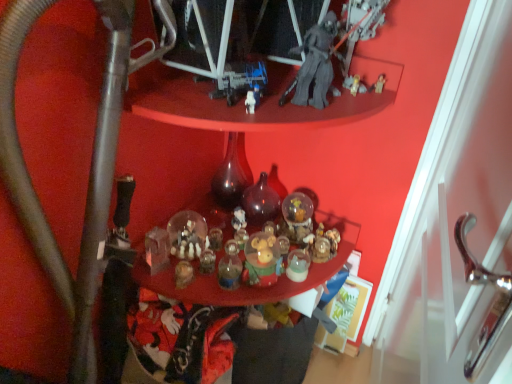
This screenshot has width=512, height=384. I want to click on translucent glass ornaments at center, so click(x=242, y=284).

Where is `translucent glass bottle at center, which is the first bottle in left-to-right order`? The height and width of the screenshot is (384, 512). translucent glass bottle at center, which is the first bottle in left-to-right order is located at coordinates coord(232,173).

Find the location of a particular element. This screenshot has width=512, height=384. metallic gray water pipe at lower left is located at coordinates click(92, 160).

Is translucent dark glass bottle at center, placed as the 1th bottle when sorted from right to left, spatially inside translucent glass ornaments at center, or outside of it?

translucent dark glass bottle at center, placed as the 1th bottle when sorted from right to left, is outside translucent glass ornaments at center.

Which of these two, translucent dark glass bottle at center, positioned as the second bottle in left-to-right order, or translucent glass ornaments at center, is bigger?

Bigger between the two is translucent glass ornaments at center.

How many degrees apart are the facing directions of translucent dark glass bottle at center, positioned as the second bottle in left-to-right order, and translucent glass ornaments at center?

98.2 degrees.

Could you tell me if translucent dark glass bottle at center, placed as the 1th bottle when sorted from right to left, is turned towards translucent glass ornaments at center?

No.

From the image's perspective, relative to translucent dark glass bottle at center, placed as the 1th bottle when sorted from right to left, is translucent glass bottle at center, which is the first bottle in left-to-right order, above or below?

translucent glass bottle at center, which is the first bottle in left-to-right order, is above translucent dark glass bottle at center, placed as the 1th bottle when sorted from right to left.

Can you confirm if translucent glass bottle at center, placed as the 2th bottle when sorted from right to left, is bigger than translucent dark glass bottle at center, positioned as the second bottle in left-to-right order?

Yes.

Is translucent glass bottle at center, which is the first bottle in left-to-right order, taller than translucent dark glass bottle at center, positioned as the second bottle in left-to-right order?

Indeed, translucent glass bottle at center, which is the first bottle in left-to-right order, has a greater height compared to translucent dark glass bottle at center, positioned as the second bottle in left-to-right order.

Where is `table below the translucent dark glass bottle at center, positioned as the second bottle in left-to-right order (from the image's perspective)`? This screenshot has width=512, height=384. table below the translucent dark glass bottle at center, positioned as the second bottle in left-to-right order (from the image's perspective) is located at coordinates (242, 284).

From the image's perspective, is translucent glass ornaments at center above or below translucent dark glass bottle at center, placed as the 1th bottle when sorted from right to left?

translucent glass ornaments at center is situated lower than translucent dark glass bottle at center, placed as the 1th bottle when sorted from right to left, in the image.

Does translucent glass ornaments at center have a greater height compared to translucent dark glass bottle at center, positioned as the second bottle in left-to-right order?

No.

Is translucent dark glass bottle at center, positioned as the second bottle in left-to-right order, not near metallic gray water pipe at lower left?

That's not correct — translucent dark glass bottle at center, positioned as the second bottle in left-to-right order, is a little close to metallic gray water pipe at lower left.

This screenshot has width=512, height=384. There is a metallic gray water pipe at lower left. In order to click on the 1st bottle above it (from a real-world perspective) in this screenshot , I will do `click(261, 202)`.

Which is behind, translucent dark glass bottle at center, positioned as the second bottle in left-to-right order, or metallic gray water pipe at lower left?

translucent dark glass bottle at center, positioned as the second bottle in left-to-right order, is further away from the camera.

Is translucent dark glass bottle at center, placed as the 1th bottle when sorted from right to left, not within metallic gray water pipe at lower left?

Indeed, translucent dark glass bottle at center, placed as the 1th bottle when sorted from right to left, is completely outside metallic gray water pipe at lower left.

Which is farther, (240, 158) or (134, 276)?

The point (240, 158) is farther.

Locate an element on the screen. This screenshot has width=512, height=384. the 2nd bottle directly above the translucent glass ornaments at center (from a real-world perspective) is located at coordinates (232, 173).

Which of these two, translucent glass bottle at center, which is the first bottle in left-to-right order, or translucent glass ornaments at center, is bigger?

translucent glass ornaments at center is bigger.

Locate an element on the screen. table below the translucent glass bottle at center, which is the first bottle in left-to-right order (from a real-world perspective) is located at coordinates (242, 284).

Does translucent glass ornaments at center have a larger size compared to translucent glass bottle at center, which is the first bottle in left-to-right order?

Yes, translucent glass ornaments at center is bigger than translucent glass bottle at center, which is the first bottle in left-to-right order.

From the image's perspective, is translucent glass ornaments at center on translucent glass bottle at center, which is the first bottle in left-to-right order?

No, from the image's perspective, translucent glass ornaments at center is not over translucent glass bottle at center, which is the first bottle in left-to-right order.

Is translucent glass bottle at center, placed as the 2th bottle when sorted from right to left, inside translucent glass ornaments at center?

That's incorrect, translucent glass bottle at center, placed as the 2th bottle when sorted from right to left, is not inside translucent glass ornaments at center.

From the image's perspective, which is below, metallic gray water pipe at lower left or translucent glass bottle at center, which is the first bottle in left-to-right order?

metallic gray water pipe at lower left appears lower in the image.

Which object is positioned more to the left, metallic gray water pipe at lower left or translucent glass bottle at center, placed as the 2th bottle when sorted from right to left?

From the viewer's perspective, metallic gray water pipe at lower left appears more on the left side.

Are metallic gray water pipe at lower left and translucent glass bottle at center, which is the first bottle in left-to-right order, making contact?

They are not placed beside each other.

This screenshot has width=512, height=384. I want to click on table to the left of translucent dark glass bottle at center, placed as the 1th bottle when sorted from right to left, so click(x=242, y=284).

In order to click on bottle below the translucent glass bottle at center, which is the first bottle in left-to-right order (from the image's perspective) in this screenshot , I will do `click(261, 202)`.

Considering their positions, is translucent dark glass bottle at center, placed as the 1th bottle when sorted from right to left, positioned further to translucent glass ornaments at center than metallic gray water pipe at lower left?

Among the two, metallic gray water pipe at lower left is located further to translucent glass ornaments at center.

Looking at the image, which one is located closer to translucent glass bottle at center, placed as the 2th bottle when sorted from right to left, translucent glass ornaments at center or metallic gray water pipe at lower left?

translucent glass ornaments at center lies closer to translucent glass bottle at center, placed as the 2th bottle when sorted from right to left, than the other object.

In the scene shown: Looking at the image, which one is located further to translucent glass bottle at center, which is the first bottle in left-to-right order, translucent glass ornaments at center or translucent dark glass bottle at center, placed as the 1th bottle when sorted from right to left?

translucent glass ornaments at center is positioned further to the anchor translucent glass bottle at center, which is the first bottle in left-to-right order.

From the image, which object appears to be nearer to metallic gray water pipe at lower left, translucent dark glass bottle at center, positioned as the second bottle in left-to-right order, or translucent glass bottle at center, which is the first bottle in left-to-right order?

Among the two, translucent glass bottle at center, which is the first bottle in left-to-right order, is located nearer to metallic gray water pipe at lower left.

Considering their positions, is metallic gray water pipe at lower left positioned further to translucent glass ornaments at center than translucent glass bottle at center, placed as the 2th bottle when sorted from right to left?

metallic gray water pipe at lower left is positioned further to the anchor translucent glass ornaments at center.

Looking at the image, which one is located closer to translucent glass bottle at center, placed as the 2th bottle when sorted from right to left, translucent dark glass bottle at center, positioned as the second bottle in left-to-right order, or metallic gray water pipe at lower left?

translucent dark glass bottle at center, positioned as the second bottle in left-to-right order, lies closer to translucent glass bottle at center, placed as the 2th bottle when sorted from right to left, than the other object.

Based on their spatial positions, is metallic gray water pipe at lower left or translucent glass ornaments at center closer to translucent dark glass bottle at center, positioned as the second bottle in left-to-right order?

translucent glass ornaments at center is closer to translucent dark glass bottle at center, positioned as the second bottle in left-to-right order.

Which object lies nearer to the anchor point metallic gray water pipe at lower left, translucent dark glass bottle at center, positioned as the second bottle in left-to-right order, or translucent glass ornaments at center?

The object closer to metallic gray water pipe at lower left is translucent glass ornaments at center.

The image size is (512, 384). I want to click on table positioned between metallic gray water pipe at lower left and translucent dark glass bottle at center, placed as the 1th bottle when sorted from right to left, from near to far, so click(x=242, y=284).

Find the location of a particular element. table positioned between metallic gray water pipe at lower left and translucent glass bottle at center, which is the first bottle in left-to-right order, from near to far is located at coordinates (242, 284).

You are a GUI agent. You are given a task and a screenshot of the screen. Output one action in this format:
    pyautogui.click(x=<x>, y=<y>)
    Task: Click on the bottle between metallic gray water pipe at lower left and translucent dark glass bottle at center, positioned as the second bottle in left-to-right order, along the z-axis
    The height and width of the screenshot is (384, 512).
    Given the screenshot: What is the action you would take?
    pyautogui.click(x=232, y=173)

The height and width of the screenshot is (384, 512). What are the coordinates of `bottle positioned between translucent glass ornaments at center and translucent dark glass bottle at center, positioned as the second bottle in left-to-right order, from near to far` in the screenshot? It's located at (232, 173).